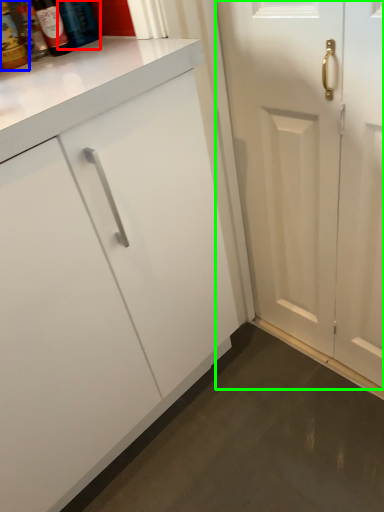
Question: Based on their relative distances, which object is farther from bottle (highlighted by a red box)? Choose from bottle (highlighted by a blue box) and door (highlighted by a green box).

Choices:
 (A) bottle
 (B) door

Answer: (B)